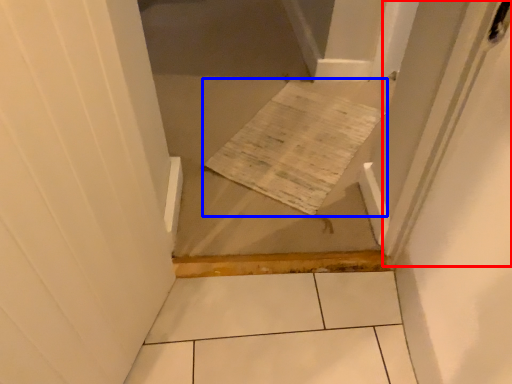
Question: Which object appears closest to the camera in this image, screen door (highlighted by a red box) or cardboard (highlighted by a blue box)?

Choices:
 (A) screen door
 (B) cardboard

Answer: (A)